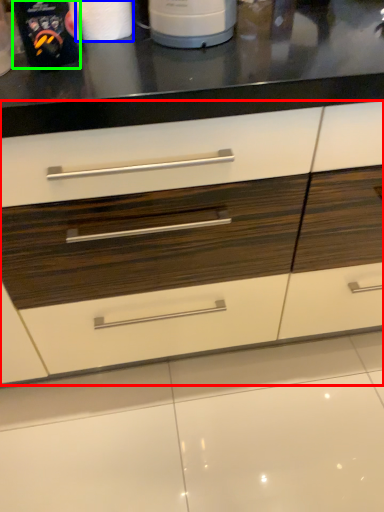
Question: Estimate the real-world distances between objects in this image. Which object is closer to drawer (highlighted by a red box), paper towel (highlighted by a blue box) or kitchen appliance (highlighted by a green box)?

Choices:
 (A) paper towel
 (B) kitchen appliance

Answer: (B)